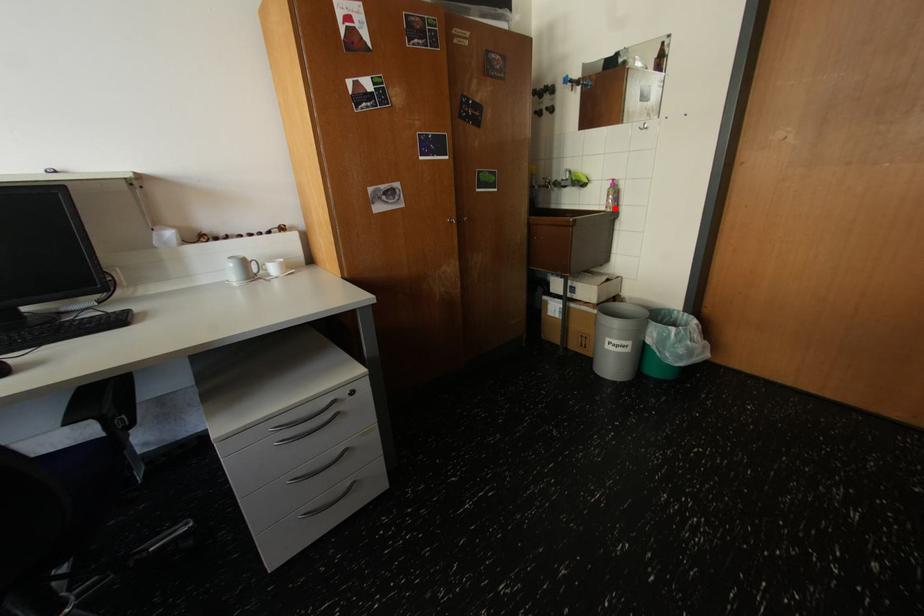
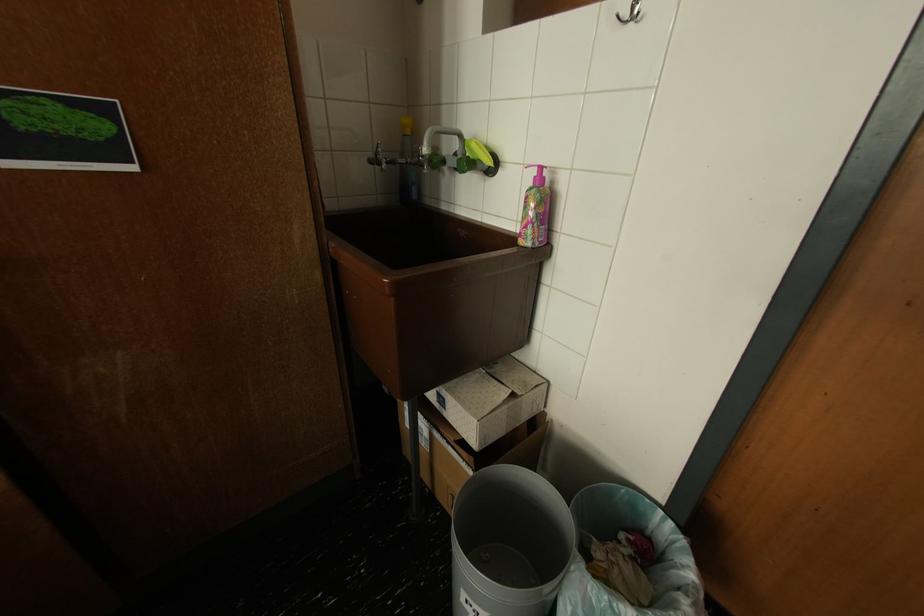
Where in the second image is the point corresponding to the highlighted location from the first image?

(529, 235)